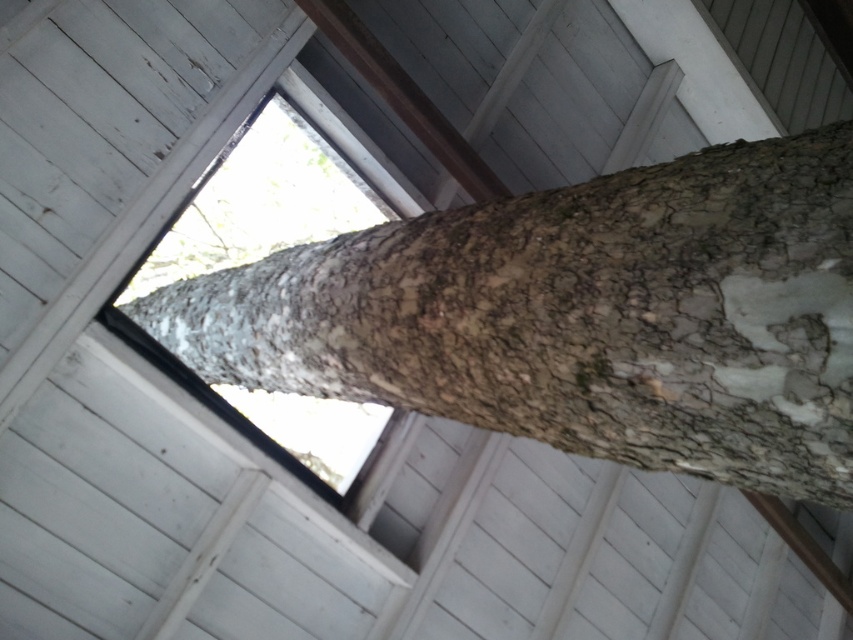
Question: From the image, what is the correct spatial relationship of rough bark tree at center in relation to transparent glass window at center?

Choices:
 (A) right
 (B) left

Answer: (A)

Question: Which point appears closest to the camera in this image?

Choices:
 (A) (201, 236)
 (B) (780, 288)

Answer: (B)

Question: Is rough bark tree at center bigger than transparent glass window at center?

Choices:
 (A) yes
 (B) no

Answer: (B)

Question: Among these points, which one is nearest to the camera?

Choices:
 (A) (341, 506)
 (B) (712, 250)

Answer: (B)

Question: Among these points, which one is farthest from the camera?

Choices:
 (A) (310, 472)
 (B) (244, 387)

Answer: (B)

Question: Does rough bark tree at center have a greater width compared to transparent glass window at center?

Choices:
 (A) no
 (B) yes

Answer: (A)